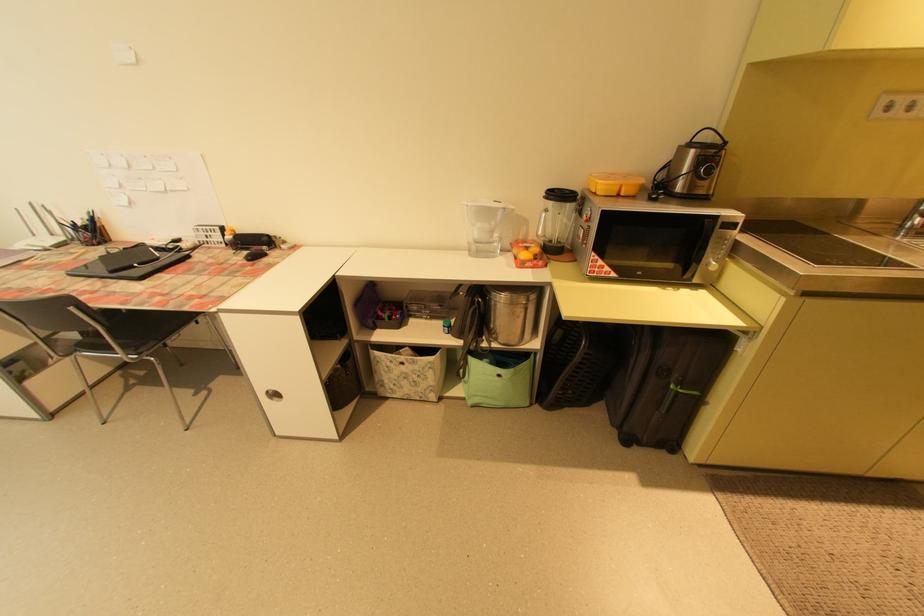
This screenshot has width=924, height=616. What do you see at coordinates (699, 248) in the screenshot? I see `the microwave door handle` at bounding box center [699, 248].